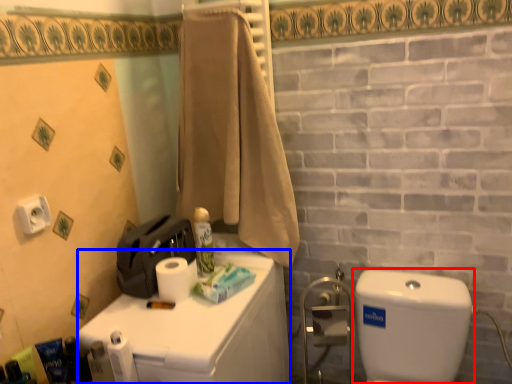
Question: Which point is closer to the camera, water tank (highlighted by a red box) or counter top (highlighted by a blue box)?

Choices:
 (A) water tank
 (B) counter top

Answer: (A)